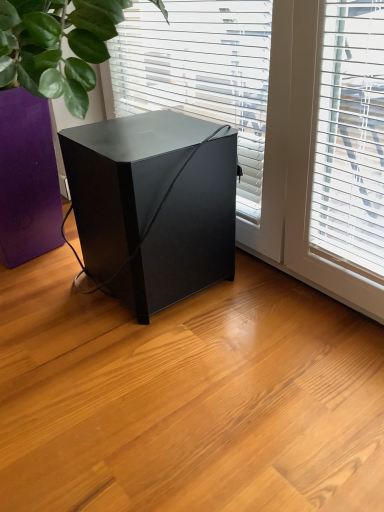
I want to click on free space in front of matte black speaker at center, so click(164, 364).